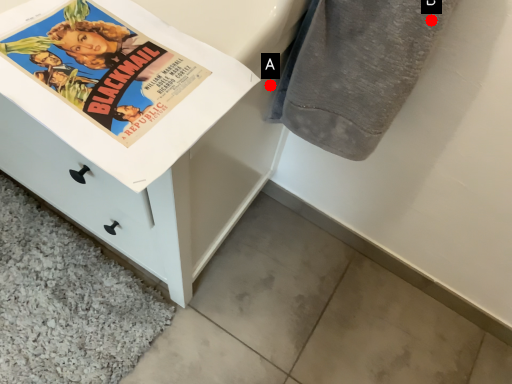
Question: Two points are circled on the image, labeled by A and B beside each circle. Which point is farther to the camera?

Choices:
 (A) A is further
 (B) B is further

Answer: (A)